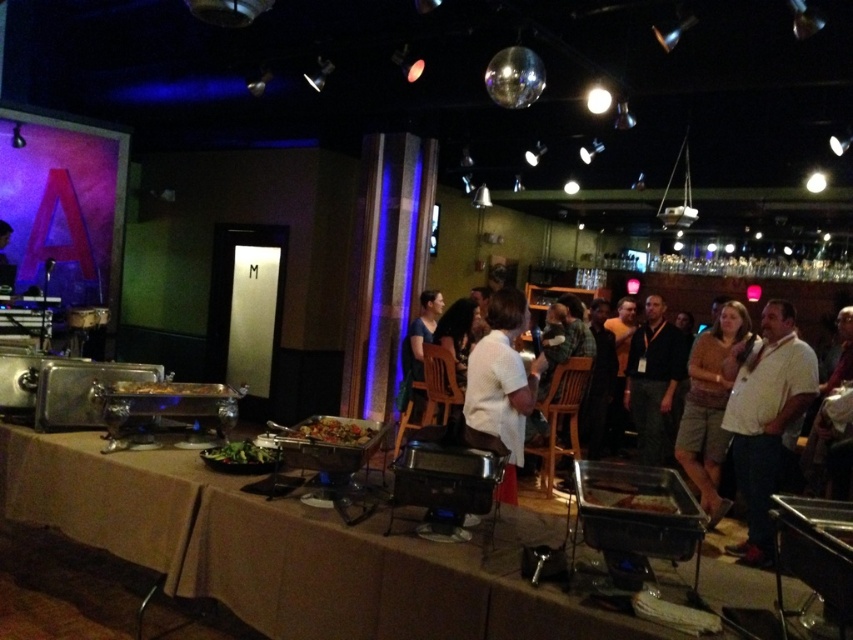
You are a photographer at the event and need to capture both the white shirt at center and the white shirt at right in a single photo. Since you want both shirts to appear clearly, which shirt should you focus on first to ensure the other remains in focus?

You should focus on the white shirt at center first because it is larger in size, ensuring that the smaller white shirt at right will stay in focus as well.

You are a photographer at the event and want to capture both the white shirt at center and the white shirt at right in a single frame. Given that your camera has a fixed focus that can only clearly capture objects within a 2 meter width, can you position yourself such that both shirts are within the focus area?

The white shirt at center is wider than the white shirt at right. Since the camera can focus on a 2 meter width, positioning yourself so both shirts are within that width would depend on their actual distance apart. However, the description only provides information about their widths, not their separation. Without knowing how far apart they are, it is impossible to determine if they can both fit within the 2 meter focus area.